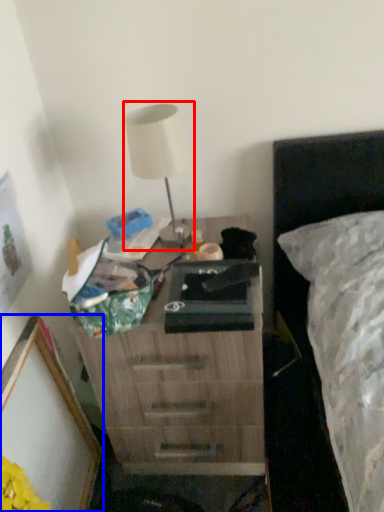
Question: Which of the following is the closest to the observer, table lamp (highlighted by a red box) or picture frame (highlighted by a blue box)?

Choices:
 (A) table lamp
 (B) picture frame

Answer: (B)